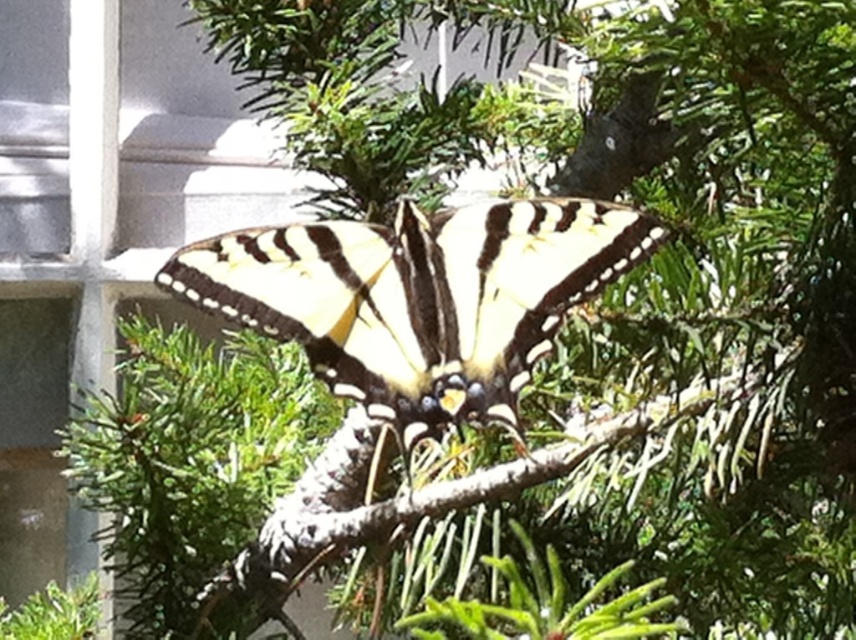
Question: Is yellow-black-patterned butterfly at center to the right of green textured branch at center from the viewer's perspective?

Choices:
 (A) no
 (B) yes

Answer: (A)

Question: Which object is farther from the camera taking this photo?

Choices:
 (A) yellow-black-patterned butterfly at center
 (B) green textured branch at center

Answer: (B)

Question: Which point is closer to the camera?

Choices:
 (A) (563, 260)
 (B) (349, 472)

Answer: (A)

Question: Is yellow-black-patterned butterfly at center to the left of green textured branch at center from the viewer's perspective?

Choices:
 (A) no
 (B) yes

Answer: (B)

Question: Considering the relative positions of yellow-black-patterned butterfly at center and green textured branch at center in the image provided, where is yellow-black-patterned butterfly at center located with respect to green textured branch at center?

Choices:
 (A) below
 (B) above

Answer: (B)